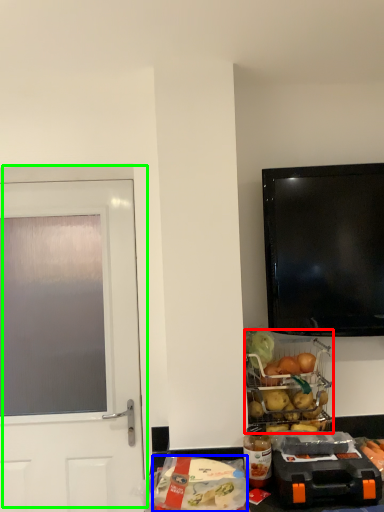
Question: Estimate the real-world distances between objects in this image. Which object is farther from appliance (highlighted by a red box), food (highlighted by a blue box) or door (highlighted by a green box)?

Choices:
 (A) food
 (B) door

Answer: (B)